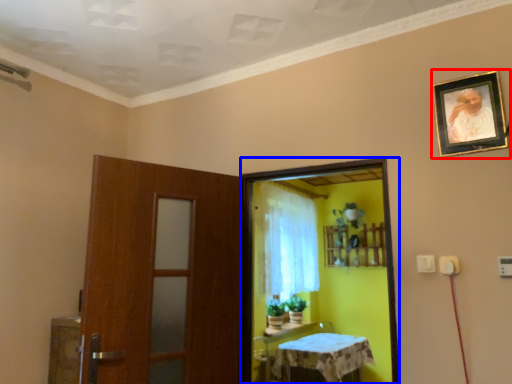
Question: Which object appears farthest to the camera in this image, picture frame (highlighted by a red box) or screen door (highlighted by a blue box)?

Choices:
 (A) picture frame
 (B) screen door

Answer: (B)